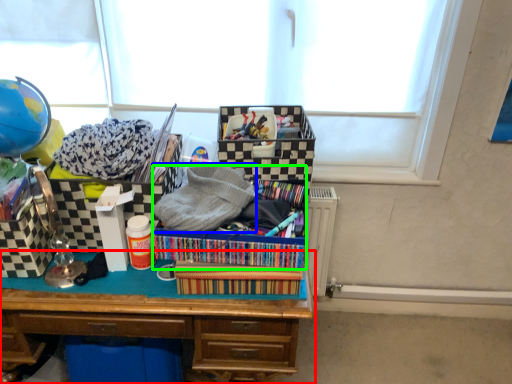
Question: Based on their relative distances, which object is nearer to desk (highlighted by a red box)? Choose from clothing (highlighted by a blue box) and kit (highlighted by a green box).

Choices:
 (A) clothing
 (B) kit

Answer: (B)